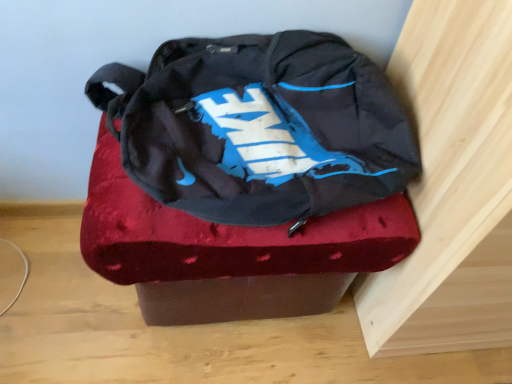
Question: From the image's perspective, is matte black backpack at center above or below velvet-like red ottoman at center?

Choices:
 (A) below
 (B) above

Answer: (B)

Question: In terms of width, does matte black backpack at center look wider or thinner when compared to velvet-like red ottoman at center?

Choices:
 (A) wide
 (B) thin

Answer: (B)

Question: Considering the positions of point tap(258, 39) and point tap(151, 316), is point tap(258, 39) closer or farther from the camera than point tap(151, 316)?

Choices:
 (A) farther
 (B) closer

Answer: (B)

Question: Which is correct: velvet-like red ottoman at center is inside matte black backpack at center, or outside of it?

Choices:
 (A) inside
 (B) outside

Answer: (B)

Question: Is point (417, 233) positioned closer to the camera than point (217, 51)?

Choices:
 (A) farther
 (B) closer

Answer: (B)

Question: Considering their positions, is velvet-like red ottoman at center located in front of or behind matte black backpack at center?

Choices:
 (A) front
 (B) behind

Answer: (B)

Question: Is velvet-like red ottoman at center wider or thinner than matte black backpack at center?

Choices:
 (A) thin
 (B) wide

Answer: (B)